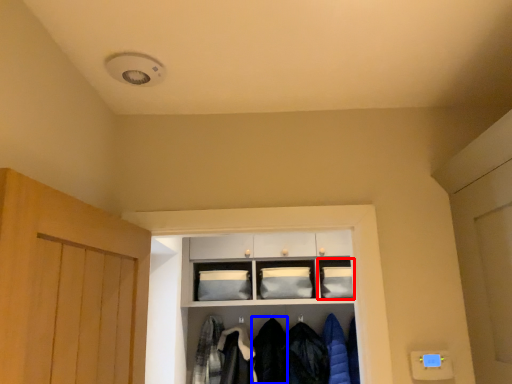
Question: Which object is closer to the camera taking this photo, cabinet (highlighted by a red box) or clothing (highlighted by a blue box)?

Choices:
 (A) cabinet
 (B) clothing

Answer: (B)